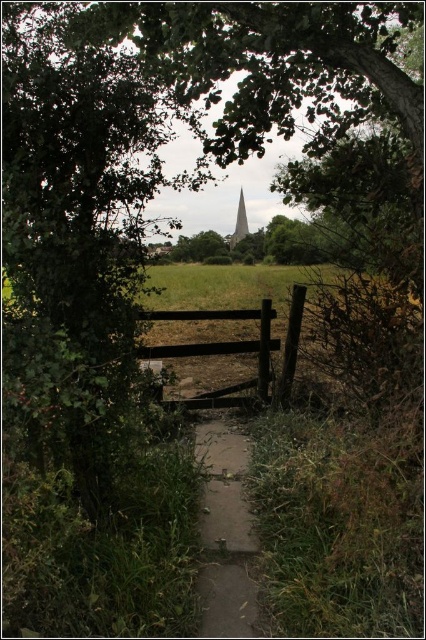
You are standing at the wooden gate and want to walk towards the smooth stone tower at center. Which direction should you turn to follow the dull concrete path at center towards it?

You should turn to the right to follow the dull concrete path at center towards the smooth stone tower at center because the dull concrete path at center is to the left of the smooth stone tower at center.

You are standing at the wooden gate in the foreground of the scene. You notice two points marked in the image. Which point, point (x=250, y=595) or point (x=250, y=317), is closer to your current position?

Point (x=250, y=595) is closer to the camera than point (x=250, y=317), so it is closer to your current position at the wooden gate.